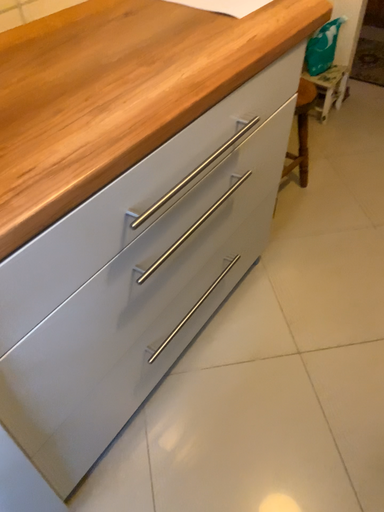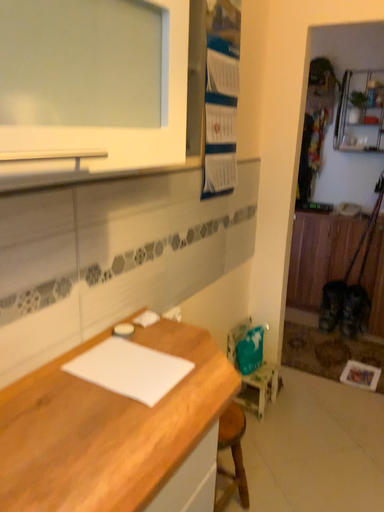
Question: How did the camera likely rotate when shooting the video?

Choices:
 (A) rotated upward
 (B) rotated downward

Answer: (A)